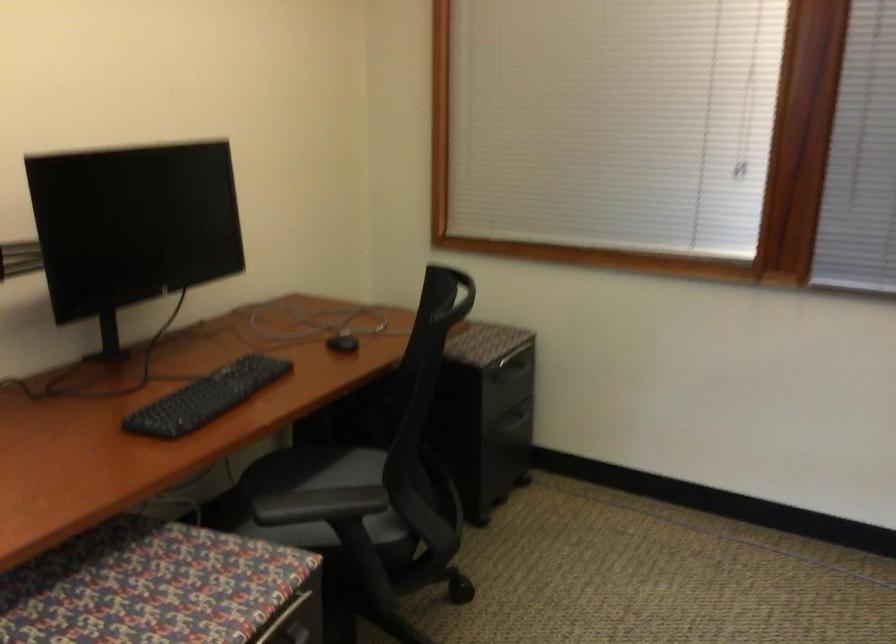
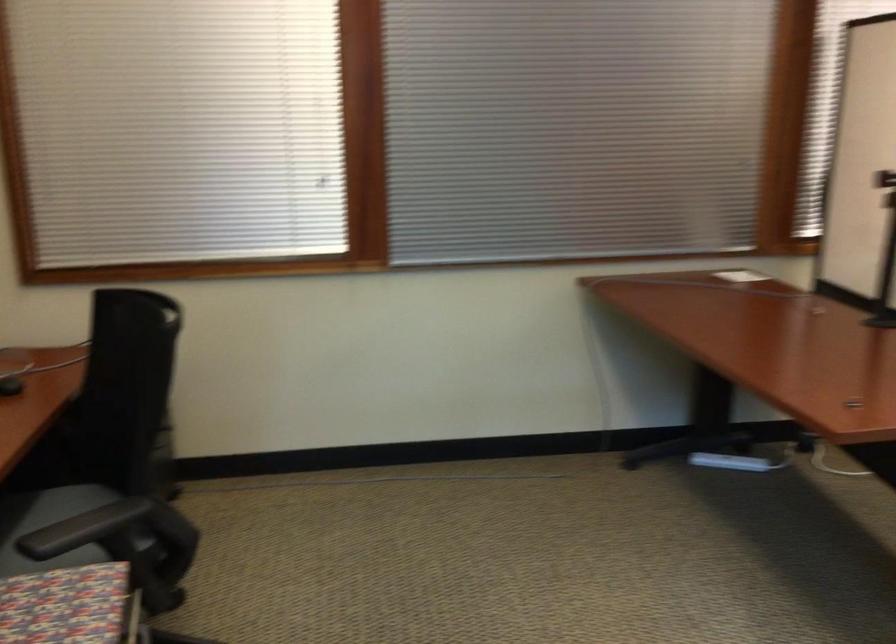
Question: The camera is either moving clockwise (left) or counter-clockwise (right) around the object. The first image is from the beginning of the video and the second image is from the end. Is the camera moving left or right when shooting the video?

Choices:
 (A) Left
 (B) Right

Answer: (A)